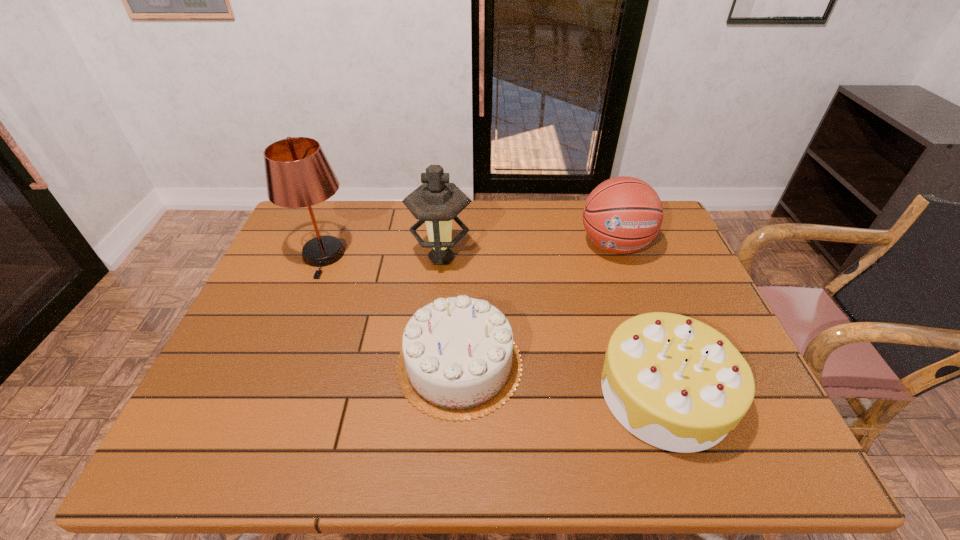
Where is `free space located on the left of the left birthday cake`? Image resolution: width=960 pixels, height=540 pixels. free space located on the left of the left birthday cake is located at coordinates (236, 364).

Identify the location of lampshade positioned at the far edge. (298, 174).

Where is `oil lamp at the far edge`? Image resolution: width=960 pixels, height=540 pixels. oil lamp at the far edge is located at coordinates (436, 202).

This screenshot has height=540, width=960. I want to click on basketball at the far edge, so [623, 214].

Where is `object situated at the near edge`? This screenshot has width=960, height=540. object situated at the near edge is located at coordinates (676, 383).

Locate an element on the screen. Image resolution: width=960 pixels, height=540 pixels. object present at the left edge is located at coordinates (298, 174).

In order to click on basketball that is positioned at the right edge in this screenshot , I will do `click(623, 214)`.

Where is `birthday cake present at the right edge`? birthday cake present at the right edge is located at coordinates (676, 383).

The width and height of the screenshot is (960, 540). Identify the location of object positioned at the far left corner. (298, 174).

Where is `object at the far right corner`? object at the far right corner is located at coordinates (623, 214).